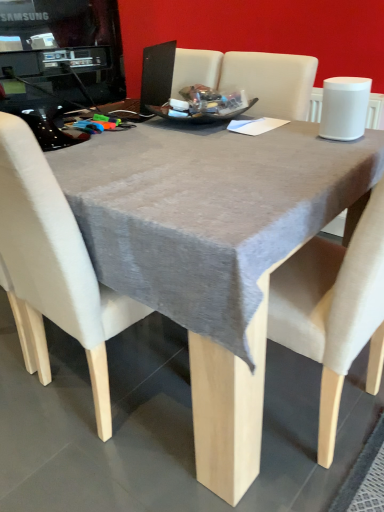
Question: Is the depth of black glossy desktop computer at upper left less than that of beige fabric chair at center?

Choices:
 (A) no
 (B) yes

Answer: (A)

Question: Can you confirm if black glossy desktop computer at upper left is bigger than beige fabric chair at center?

Choices:
 (A) yes
 (B) no

Answer: (B)

Question: Does black glossy desktop computer at upper left have a lesser width compared to beige fabric chair at center?

Choices:
 (A) no
 (B) yes

Answer: (B)

Question: Would you say black glossy desktop computer at upper left is outside beige fabric chair at center?

Choices:
 (A) no
 (B) yes

Answer: (B)

Question: Is the position of black glossy desktop computer at upper left more distant than that of beige fabric chair at center?

Choices:
 (A) no
 (B) yes

Answer: (B)

Question: Does black glossy desktop computer at upper left appear on the right side of beige fabric chair at center?

Choices:
 (A) yes
 (B) no

Answer: (B)

Question: Is beige fabric chair at center positioned in front of gray fabric table at center?

Choices:
 (A) yes
 (B) no

Answer: (B)

Question: Is beige fabric chair at center bigger than gray fabric table at center?

Choices:
 (A) yes
 (B) no

Answer: (B)

Question: Would you say beige fabric chair at center contains gray fabric table at center?

Choices:
 (A) yes
 (B) no

Answer: (B)

Question: Is beige fabric chair at center wider than gray fabric table at center?

Choices:
 (A) no
 (B) yes

Answer: (A)

Question: From a real-world perspective, is beige fabric chair at center below gray fabric table at center?

Choices:
 (A) yes
 (B) no

Answer: (B)

Question: Can you confirm if beige fabric chair at center is positioned to the left of gray fabric table at center?

Choices:
 (A) yes
 (B) no

Answer: (A)

Question: Is black glossy desktop computer at upper left looking in the opposite direction of gray fabric table at center?

Choices:
 (A) yes
 (B) no

Answer: (B)